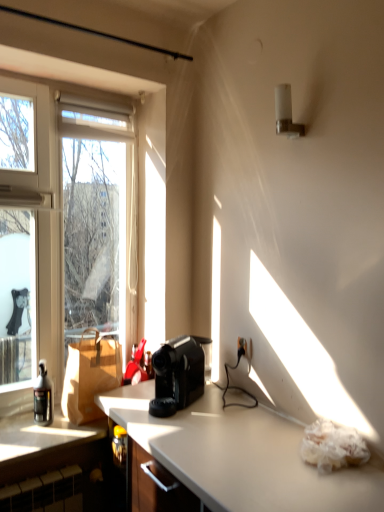
Identify the location of vacant region in front of translucent glass bottle at left. This screenshot has height=512, width=384. (31, 437).